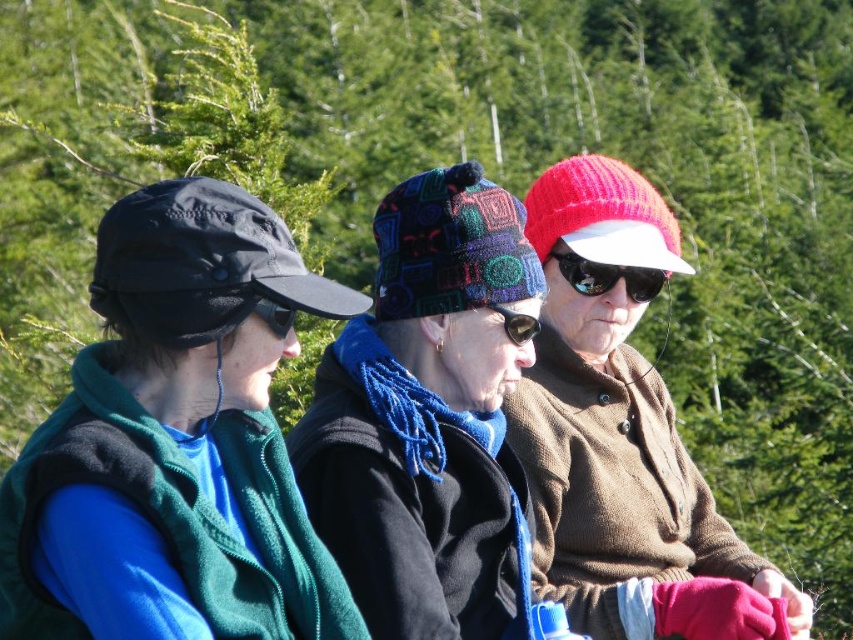
Question: Among these points, which one is farthest from the camera?

Choices:
 (A) (589, 602)
 (B) (564, 276)
 (C) (265, 300)

Answer: (B)

Question: Based on their relative distances, which object is farther from the black matte goggles at center?

Choices:
 (A) black rubber goggles at center
 (B) knitted red hat at center

Answer: (B)

Question: Is black reflective sunglasses at center positioned behind black rubber goggles at center?

Choices:
 (A) no
 (B) yes

Answer: (B)

Question: Estimate the real-world distances between objects in this image. Which object is closer to the black reflective sunglasses at center?

Choices:
 (A) knitted woolen hat at center
 (B) black matte goggles at center
 (C) matte black cap at left

Answer: (A)

Question: Can you confirm if knitted woolen hat at center is positioned to the right of black reflective sunglasses at center?

Choices:
 (A) no
 (B) yes

Answer: (A)

Question: Can you confirm if knitted woolen hat at center is positioned to the left of knitted red hat at center?

Choices:
 (A) yes
 (B) no

Answer: (A)